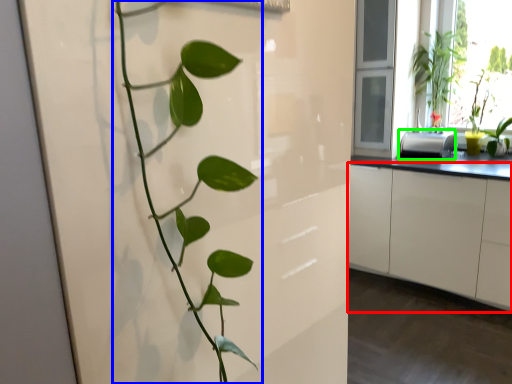
Question: Which object is positioned farthest from cabinetry (highlighted by a red box)? Select from houseplant (highlighted by a blue box) and appliance (highlighted by a green box).

Choices:
 (A) houseplant
 (B) appliance

Answer: (A)